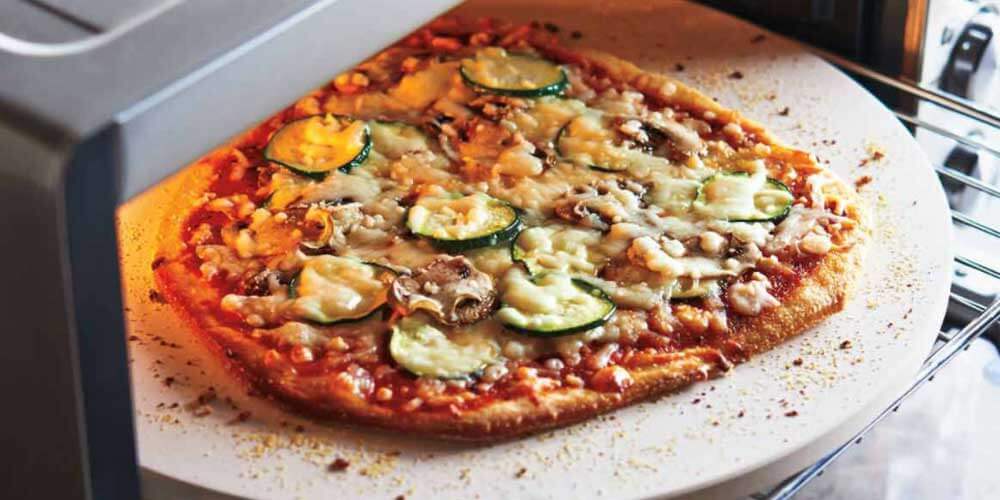
Image resolution: width=1000 pixels, height=500 pixels. What are the coordinates of `platter pizza is on` in the screenshot? It's located at (803, 384).